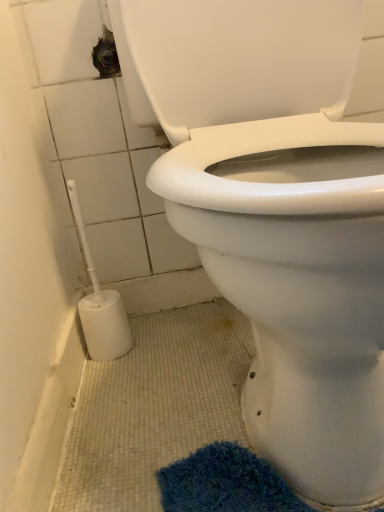
Question: Is white plastic bidet at lower left to the left or to the right of white plastic toilet brush at lower left in the image?

Choices:
 (A) right
 (B) left

Answer: (A)

Question: From a real-world perspective, is white plastic bidet at lower left above or below white plastic toilet brush at lower left?

Choices:
 (A) above
 (B) below

Answer: (A)

Question: Is white plastic bidet at lower left in front of or behind white plastic toilet brush at lower left in the image?

Choices:
 (A) behind
 (B) front

Answer: (B)

Question: Is white plastic toilet brush at lower left inside the boundaries of white plastic bidet at lower left, or outside?

Choices:
 (A) inside
 (B) outside

Answer: (B)

Question: From their relative heights in the image, would you say white plastic toilet brush at lower left is taller or shorter than white plastic bidet at lower left?

Choices:
 (A) tall
 (B) short

Answer: (B)

Question: Looking at the image, does white plastic toilet brush at lower left seem bigger or smaller compared to white plastic bidet at lower left?

Choices:
 (A) small
 (B) big

Answer: (A)

Question: In the image, is white plastic toilet brush at lower left on the left side or the right side of white plastic bidet at lower left?

Choices:
 (A) left
 (B) right

Answer: (A)